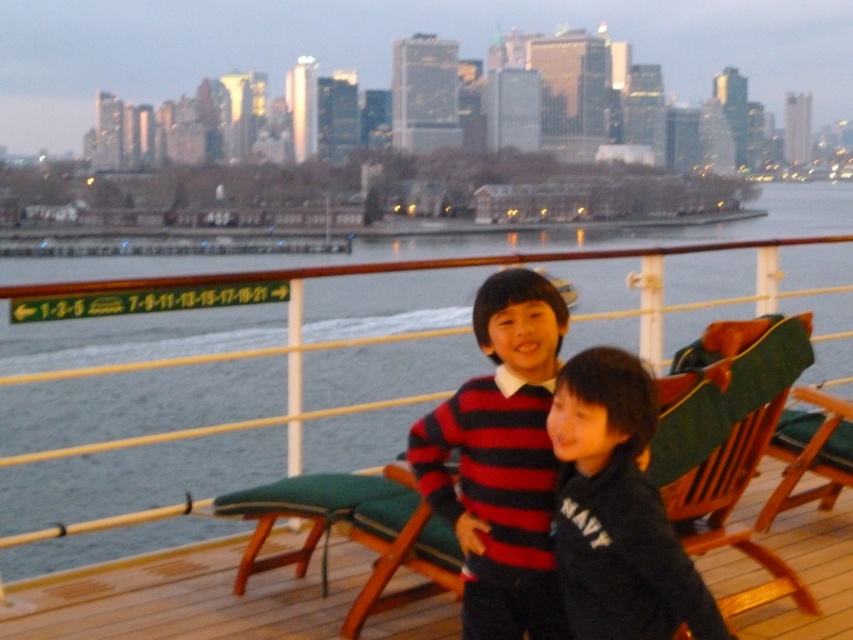
Question: Observing the image, what is the correct spatial positioning of striped knit sweater at center in reference to green water at center?

Choices:
 (A) above
 (B) below

Answer: (B)

Question: Is black fleece sweatshirt at center closer to the viewer compared to green water at center?

Choices:
 (A) no
 (B) yes

Answer: (B)

Question: Which point is farther to the camera?

Choices:
 (A) green fabric cushion at right
 (B) green water at center

Answer: (B)

Question: Can you confirm if striped knit sweater at center is wider than green water at center?

Choices:
 (A) no
 (B) yes

Answer: (A)

Question: Which point appears farthest from the camera in this image?

Choices:
 (A) (68, 372)
 (B) (474, 586)

Answer: (A)

Question: Which object appears closest to the camera in this image?

Choices:
 (A) black fleece sweatshirt at center
 (B) striped knit sweater at center
 (C) green water at center
 (D) green fabric cushion at right

Answer: (A)